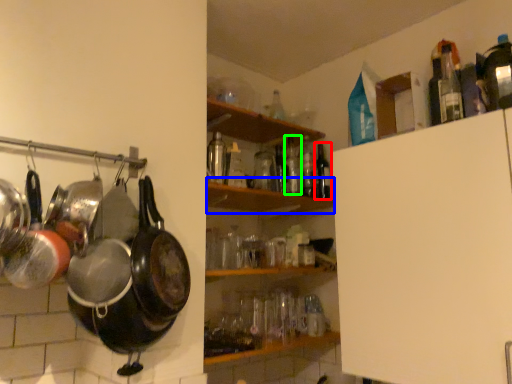
Question: Based on their relative distances, which object is nearer to bottle (highlighted by a red box)? Choose from shelf (highlighted by a blue box) and bottle (highlighted by a green box).

Choices:
 (A) shelf
 (B) bottle

Answer: (B)